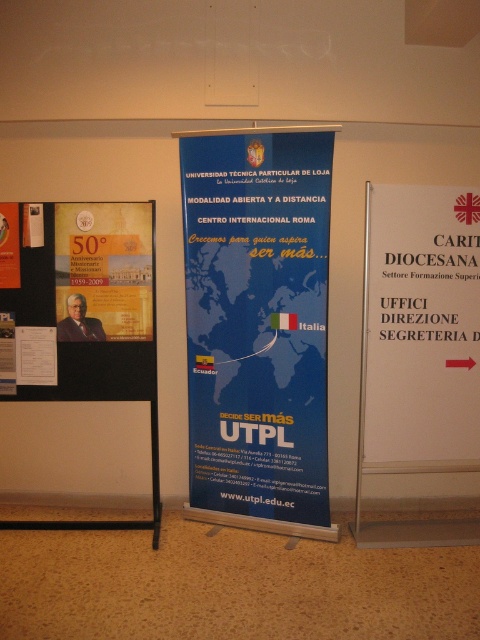
Looking at this image, you are a student trying to read the contact information on the blue paperboard poster at center and the matte gold paper at left. Which poster do you need to move closer to in order to read the text clearly?

The blue paperboard poster at center has a lesser width compared to matte gold paper at left, so you need to move closer to the blue paperboard poster at center to read its text clearly since it is smaller.

You are standing in front of the wall with the three banners. You need to locate the matte gold paper at left. Where exactly is it positioned relative to the central blue poster?

The matte gold paper at left is located at point (76,301) relative to the central blue poster.